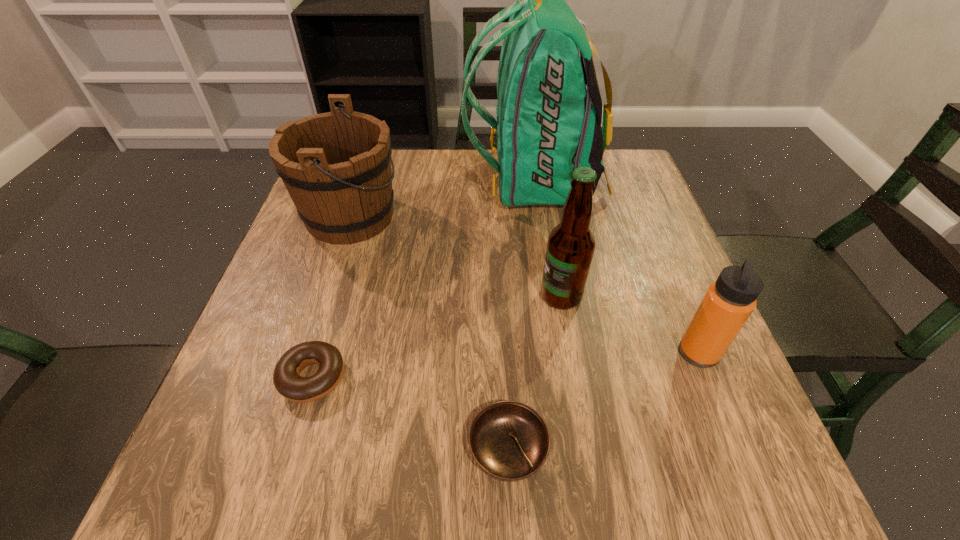
Locate an element on the screen. The image size is (960, 540). free region at the near left corner of the desktop is located at coordinates (232, 484).

What are the coordinates of `vacant space at the far right corner` in the screenshot? It's located at (603, 186).

Where is `vacant point at the near right corner`? The height and width of the screenshot is (540, 960). vacant point at the near right corner is located at coordinates (675, 503).

This screenshot has height=540, width=960. Find the location of `free point between the rightmost object and the doughnut`. free point between the rightmost object and the doughnut is located at coordinates (506, 365).

Identify the location of vacant area between the wine bucket and the tallest object. The height and width of the screenshot is (540, 960). (443, 199).

You are a GUI agent. You are given a task and a screenshot of the screen. Output one action in this format:
    pyautogui.click(x=<x>, y=<y>)
    Task: Click on the free spot between the nearest object and the rightmost object
    The width and height of the screenshot is (960, 540).
    Given the screenshot: What is the action you would take?
    pyautogui.click(x=603, y=401)

Locate an element on the screen. empty location between the thermos bottle and the doughnut is located at coordinates (506, 365).

Where is `free space between the rightmost object and the soup bowl`? This screenshot has height=540, width=960. free space between the rightmost object and the soup bowl is located at coordinates (603, 401).

This screenshot has height=540, width=960. Find the location of `free spot between the thermos bottle and the doughnut`. free spot between the thermos bottle and the doughnut is located at coordinates (506, 365).

The image size is (960, 540). In order to click on free space between the thermos bottle and the backpack in this screenshot , I will do `click(616, 267)`.